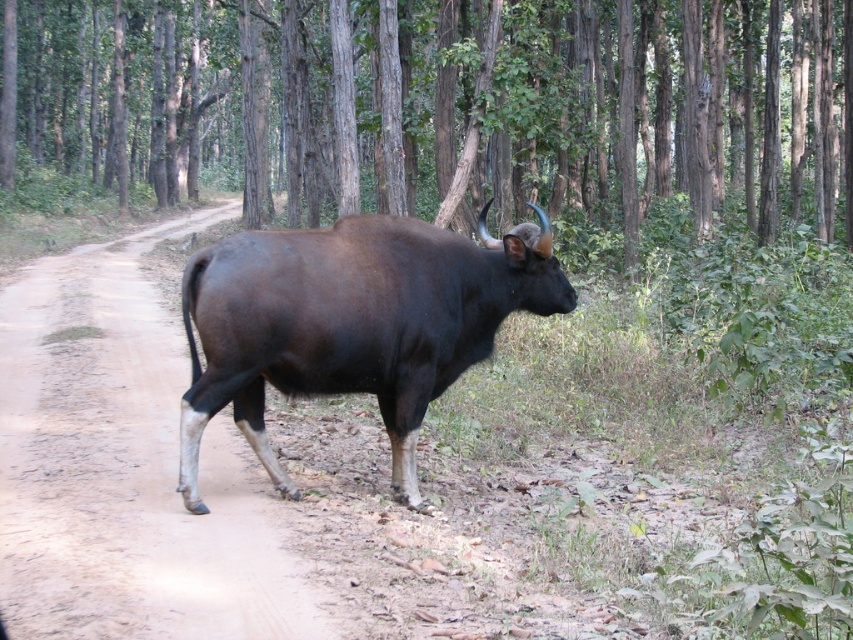
Is point (645, 163) farther from viewer compared to point (486, 348)?

Yes.

Find the location of a particular element. brown wood tree at center is located at coordinates (444, 106).

Does brown wood tree at center lie behind brown dirt track at center?

Yes, brown wood tree at center is behind brown dirt track at center.

Does brown wood tree at center have a lesser width compared to brown dirt track at center?

Incorrect, brown wood tree at center's width is not less than brown dirt track at center's.

Is point (328, 168) more distant than point (280, 544)?

That is True.

What are the coordinates of `brown wood tree at center` in the screenshot? It's located at (444, 106).

Does brown dirt track at center appear over shiny dark brown bull at center?

No, brown dirt track at center is not above shiny dark brown bull at center.

Does brown dirt track at center appear on the left side of shiny dark brown bull at center?

Yes, brown dirt track at center is to the left of shiny dark brown bull at center.

Where is `brown dirt track at center`? The image size is (853, 640). brown dirt track at center is located at coordinates (x=125, y=468).

Where is `brown dirt track at center`? This screenshot has height=640, width=853. brown dirt track at center is located at coordinates (125, 468).